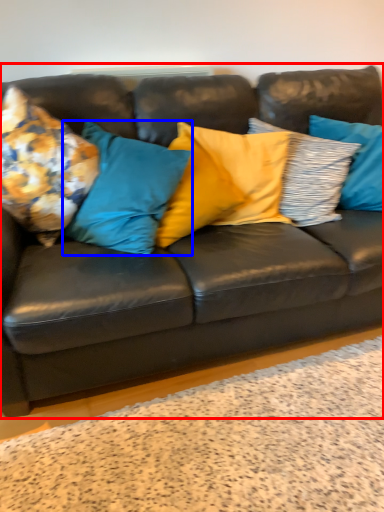
Question: Which object appears farthest to the camera in this image, studio couch (highlighted by a red box) or pillow (highlighted by a blue box)?

Choices:
 (A) studio couch
 (B) pillow

Answer: (B)